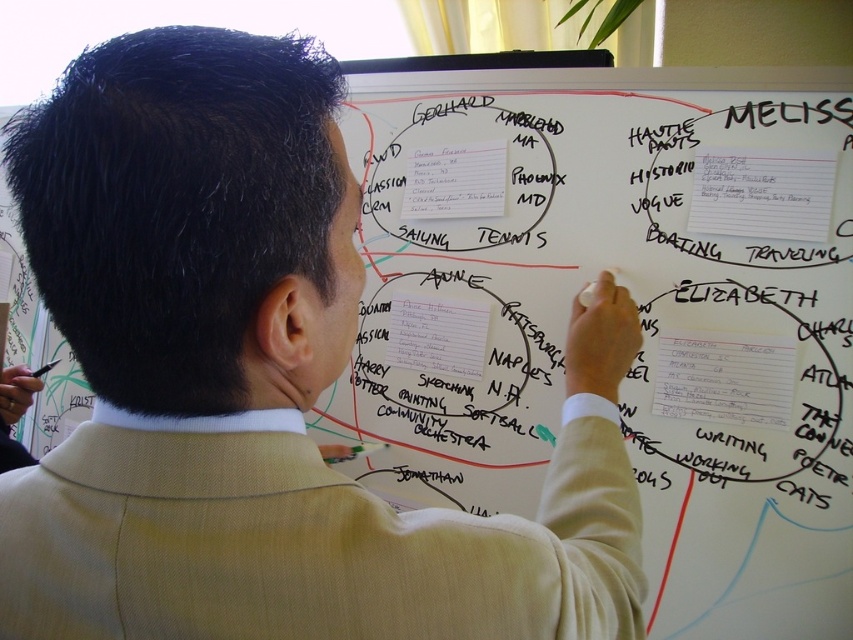
Locate an element on the screen. beige suit at center is located at coordinates (260, 381).

From the picture: Who is more forward, (281, 369) or (738, 436)?

Point (281, 369) is more forward.

This screenshot has height=640, width=853. I want to click on beige suit at center, so click(x=260, y=381).

Is white paperboard at center in front of beige wool suit at center?

No, white paperboard at center is further to the viewer.

Which is more to the left, white paperboard at center or beige wool suit at center?

From the viewer's perspective, beige wool suit at center appears more on the left side.

This screenshot has width=853, height=640. What do you see at coordinates (636, 301) in the screenshot? I see `white paperboard at center` at bounding box center [636, 301].

This screenshot has height=640, width=853. In order to click on white paperboard at center in this screenshot , I will do `click(636, 301)`.

Is point (612, 564) behind point (415, 346)?

That is False.

Can you confirm if beige suit at center is positioned below white paper at center?

Correct, beige suit at center is located below white paper at center.

Is point (200, 497) closer to viewer compared to point (466, 307)?

Yes, point (200, 497) is in front of point (466, 307).

Identify the location of beige suit at center. (260, 381).